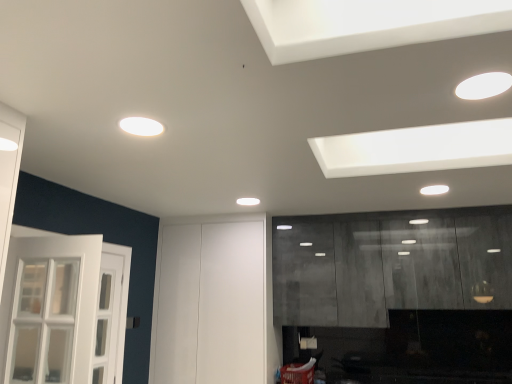
Question: From a real-world perspective, is white glossy light fixture at upper right, the 1th lighting from the front, over white matte door at center?

Choices:
 (A) yes
 (B) no

Answer: (A)

Question: Can you confirm if white glossy light fixture at upper right, acting as the 1th lighting starting from the top, is bigger than white matte door at center?

Choices:
 (A) yes
 (B) no

Answer: (B)

Question: Is white glossy light fixture at upper right, the second lighting viewed from the back, smaller than white matte door at center?

Choices:
 (A) no
 (B) yes

Answer: (B)

Question: From the image's perspective, is white glossy light fixture at upper right, acting as the 2th lighting starting from the left, over white matte door at center?

Choices:
 (A) no
 (B) yes

Answer: (B)

Question: Is white glossy light fixture at upper right, which is the 2th lighting from bottom to top, further to camera compared to white matte door at center?

Choices:
 (A) no
 (B) yes

Answer: (A)

Question: Are white glossy light fixture at upper right, which is the 2th lighting from bottom to top, and white matte door at center located far from each other?

Choices:
 (A) no
 (B) yes

Answer: (B)

Question: Can you confirm if white matte light fixture at upper center, which is the 1th lighting in bottom-to-top order, is positioned to the left of matte gray cabinetry at right?

Choices:
 (A) yes
 (B) no

Answer: (A)

Question: Could you tell me if white matte light fixture at upper center, which is the 1th lighting in bottom-to-top order, is facing matte gray cabinetry at right?

Choices:
 (A) no
 (B) yes

Answer: (A)

Question: From the image's perspective, is white matte light fixture at upper center, the 1th lighting in the left-to-right sequence, on matte gray cabinetry at right?

Choices:
 (A) yes
 (B) no

Answer: (A)

Question: Does white matte light fixture at upper center, which is the 1th lighting in bottom-to-top order, have a greater height compared to matte gray cabinetry at right?

Choices:
 (A) no
 (B) yes

Answer: (A)

Question: Considering the relative sizes of white matte light fixture at upper center, which is counted as the 1th lighting, starting from the back, and matte gray cabinetry at right in the image provided, is white matte light fixture at upper center, which is counted as the 1th lighting, starting from the back, smaller than matte gray cabinetry at right?

Choices:
 (A) yes
 (B) no

Answer: (A)

Question: Considering the relative positions of white matte light fixture at upper center, which is counted as the 1th lighting, starting from the back, and matte gray cabinetry at right in the image provided, is white matte light fixture at upper center, which is counted as the 1th lighting, starting from the back, in front of matte gray cabinetry at right?

Choices:
 (A) yes
 (B) no

Answer: (A)

Question: From the image's perspective, is white glossy light fixture at upper right, acting as the 2th lighting starting from the left, over matte gray cabinetry at right?

Choices:
 (A) yes
 (B) no

Answer: (A)